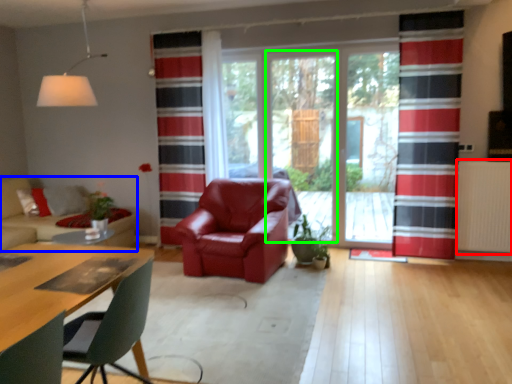
Question: Which is farther away from radiator (highlighted by a red box)? studio couch (highlighted by a blue box) or screen door (highlighted by a green box)?

Choices:
 (A) studio couch
 (B) screen door

Answer: (A)